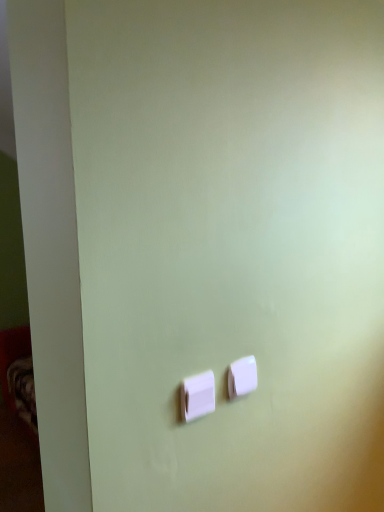
Question: From the image's perspective, is white plastic light switch at center, marked as the 2th light switch in a front-to-back arrangement, located above or below white plastic light switch at center, marked as the 1th light switch in a left-to-right arrangement?

Choices:
 (A) below
 (B) above

Answer: (B)

Question: Considering the positions of white plastic light switch at center, marked as the 2th light switch in a front-to-back arrangement, and white plastic light switch at center, marked as the 1th light switch in a left-to-right arrangement, in the image, is white plastic light switch at center, marked as the 2th light switch in a front-to-back arrangement, bigger or smaller than white plastic light switch at center, marked as the 1th light switch in a left-to-right arrangement,?

Choices:
 (A) big
 (B) small

Answer: (B)

Question: Relative to white plastic light switch at center, which appears as the second light switch when viewed from the back, is white plastic light switch at center, the 1th light switch viewed from the back, in front or behind?

Choices:
 (A) behind
 (B) front

Answer: (A)

Question: In the image, is white plastic light switch at center, which appears as the second light switch when viewed from the back, on the left side or the right side of white plastic light switch at center, which is the first light switch from right to left?

Choices:
 (A) left
 (B) right

Answer: (A)

Question: In the image, is white plastic light switch at center, which appears as the 2th light switch when viewed from the right, positioned in front of or behind white plastic light switch at center, the 2th light switch in the left-to-right sequence?

Choices:
 (A) behind
 (B) front

Answer: (B)

Question: Is white plastic light switch at center, which appears as the 2th light switch when viewed from the right, wider or thinner than white plastic light switch at center, marked as the 2th light switch in a front-to-back arrangement?

Choices:
 (A) thin
 (B) wide

Answer: (B)

Question: Is point (185, 394) positioned closer to the camera than point (253, 376)?

Choices:
 (A) closer
 (B) farther

Answer: (A)